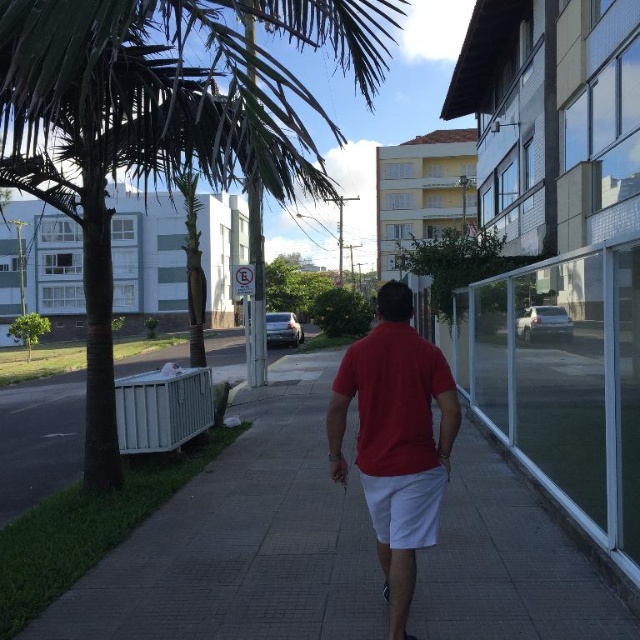
Question: Does red matte shirt at center have a larger size compared to white concrete pavement at lower left?

Choices:
 (A) no
 (B) yes

Answer: (A)

Question: Among these objects, which one is farthest from the camera?

Choices:
 (A) red matte shirt at center
 (B) green leafy palm tree at left
 (C) white concrete pavement at lower left

Answer: (C)

Question: Can you confirm if green leafy palm tree at left is positioned above red matte shirt at center?

Choices:
 (A) yes
 (B) no

Answer: (A)

Question: Which point is closer to the camera?

Choices:
 (A) green leafy palm tree at left
 (B) red matte shirt at center

Answer: (A)

Question: Considering the relative positions of green leafy palm tree at left and white concrete pavement at lower left in the image provided, where is green leafy palm tree at left located with respect to white concrete pavement at lower left?

Choices:
 (A) below
 (B) above

Answer: (B)

Question: Which object appears closest to the camera in this image?

Choices:
 (A) white concrete pavement at lower left
 (B) green leafy palm tree at left
 (C) red matte shirt at center

Answer: (B)